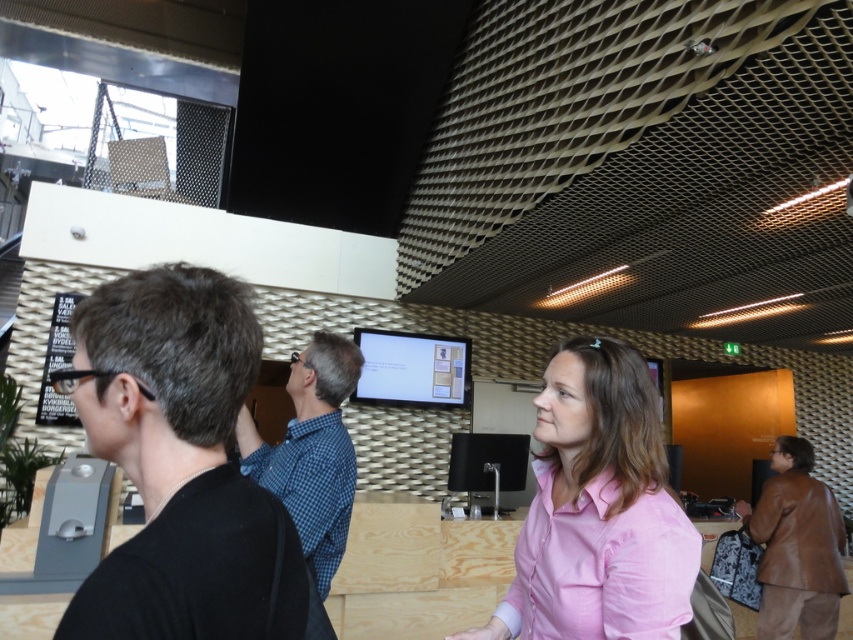
You are standing in the office and need to hand a document to both the person wearing the black matte shirt at left and the person wearing the brown leather jacket at lower right. If you are currently at the center of the room, which direction should you walk to first reach the person closer to you?

The black matte shirt at left is 3.84 meters away from the brown leather jacket at lower right. Since you are at the center, the distance to each person depends on their positions. However, without knowing the exact positions relative to the center, we cannot determine who is closer. Please provide more information about their locations.

You are an interior designer assessing the spatial layout of this office. You notice the black matte shirt at left and the brown leather jacket at lower right. Which of these two items has a narrower width?

The black matte shirt at left has a lesser width compared to the brown leather jacket at lower right, making it the narrower item.

You are standing at the entrance of the office and want to greet the person wearing the pink fabric shirt at center and the person wearing the brown leather jacket at lower right. If you walk straight ahead, which one will you reach first?

The pink fabric shirt at center is 3.10 meters away from the brown leather jacket at lower right. Since you are walking straight ahead from the entrance, you will reach the brown leather jacket at lower right first because it is closer to your starting position compared to the pink fabric shirt at center.